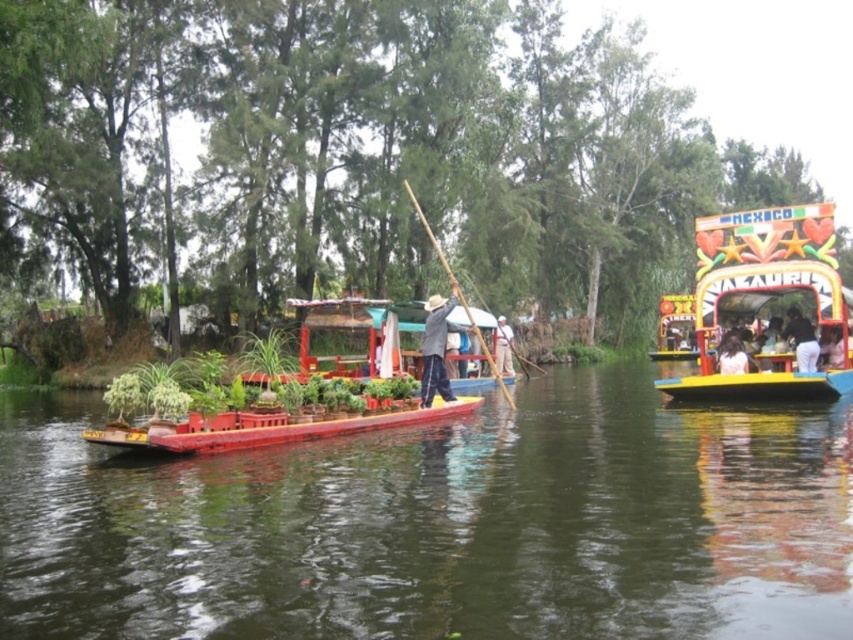
Looking at this image, you are standing on the bank of the waterway and want to reach a specific point marked at coordinates point (787, 520). If your boat can travel up to 20 meters per minute, how long will it take to reach that point?

The distance of point (787, 520) from viewer is 23.64 meters. At a speed of 20 meters per minute, it will take approximately 1.18 minutes, which is roughly 1 minute and 11 seconds to reach the point.

You are planning to load a large cargo box onto one of the boats in the scene. The cargo box is 5 meters wide. Which boat, the decorative painted wood boat at center or the wooden at center, can accommodate the cargo box based on their widths?

The decorative painted wood boat at center has a greater width than the wooden at center, so it can accommodate the 5 meter wide cargo box if its width is sufficient.

You are standing on a bridge that is 15 meters above the water. You want to drop a small floating device into the smooth wood river at center. Will the device land in the river?

The smooth wood river at center is 17.23 meters away from the camera. Since the bridge is 15 meters above the water, the device will land in the river.